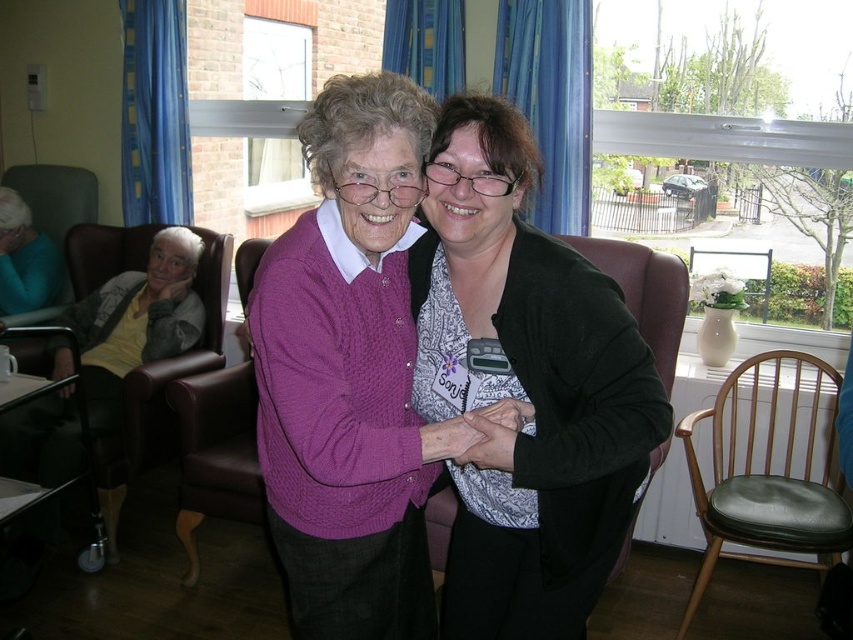
Question: Is matte purple sweater at center to the right of green leather armchair at lower right from the viewer's perspective?

Choices:
 (A) yes
 (B) no

Answer: (B)

Question: Which object is the farthest from the matte yellow sweater at left?

Choices:
 (A) matte purple sweater at center
 (B) green leather armchair at lower right

Answer: (B)

Question: In this image, where is matte purple sweater at center located relative to matte yellow sweater at left?

Choices:
 (A) left
 (B) right

Answer: (B)

Question: Which point is farther from the camera taking this photo?

Choices:
 (A) (730, 472)
 (B) (112, 422)

Answer: (B)

Question: Estimate the real-world distances between objects in this image. Which object is closer to the matte purple sweater at center?

Choices:
 (A) matte yellow sweater at left
 (B) green leather armchair at lower right

Answer: (B)

Question: Can you confirm if matte purple sweater at center is bigger than green leather armchair at lower right?

Choices:
 (A) yes
 (B) no

Answer: (B)